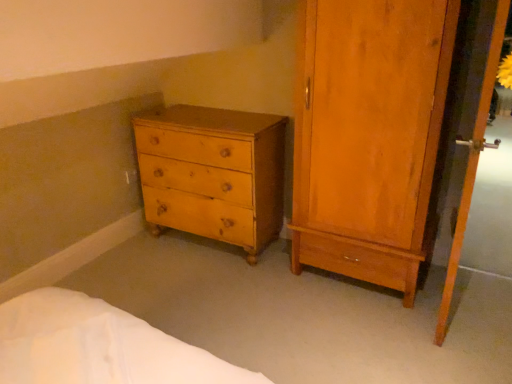
Identify the location of vacant space in front of light brown wood chest of drawers at lower left. (209, 294).